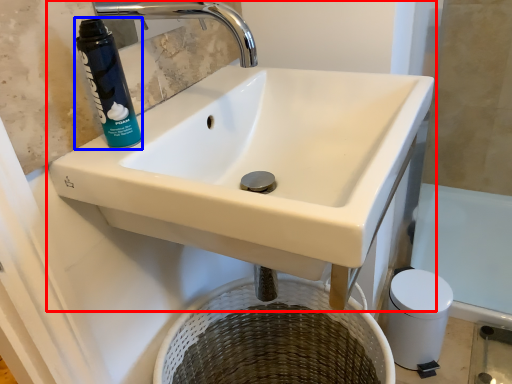
Question: Which object appears closest to the camera in this image, sink (highlighted by a red box) or cleaning product (highlighted by a blue box)?

Choices:
 (A) sink
 (B) cleaning product

Answer: (A)